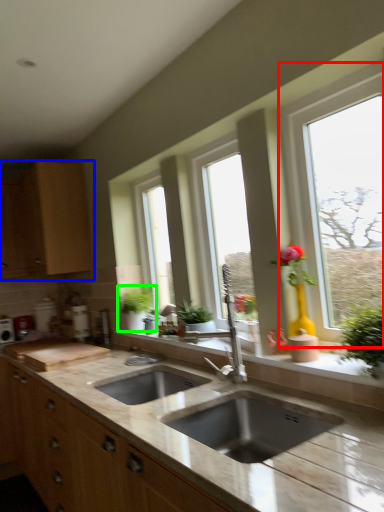
Question: Based on their relative distances, which object is farther from window (highlighted by a red box)? Choose from cabinetry (highlighted by a blue box) and houseplant (highlighted by a green box).

Choices:
 (A) cabinetry
 (B) houseplant

Answer: (A)